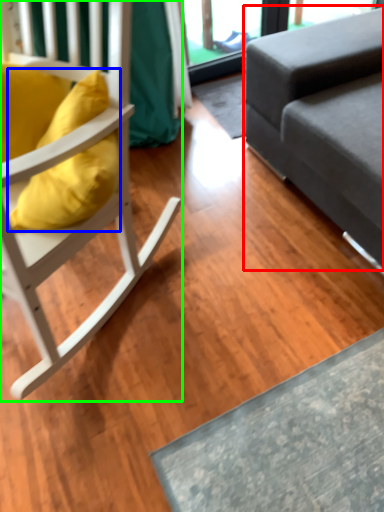
Question: Which object is positioned closest to studio couch (highlighted by a red box)? Select from pillow (highlighted by a blue box) and chair (highlighted by a green box).

Choices:
 (A) pillow
 (B) chair

Answer: (B)